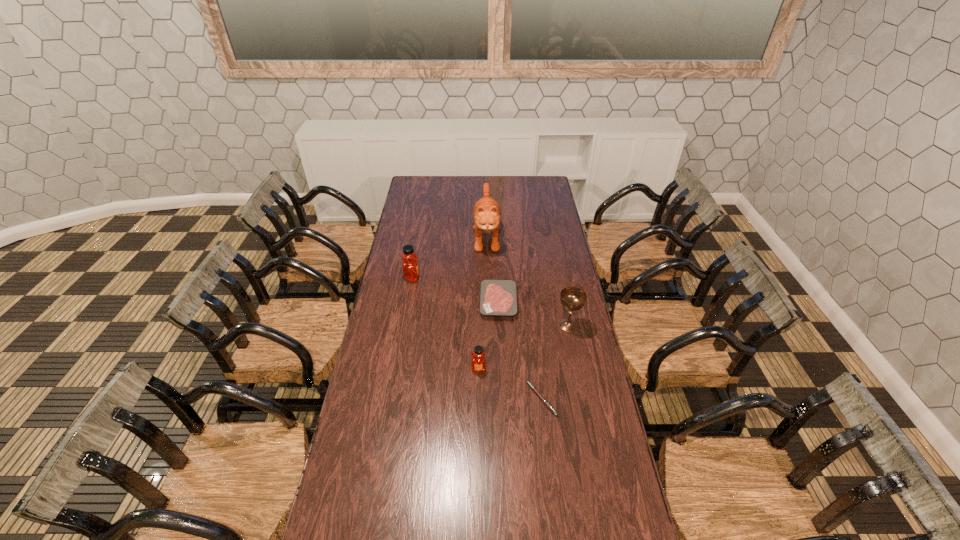
The honeys are evenly distributed in the image. To maintain this, where would you place another honey on the right? Please point to a free space. Please provide its 2D coordinates. Your answer should be formatted as a tuple, i.e. [(x, y)], where the tuple contains the x and y coordinates of a point satisfying the conditions above.

[(586, 518)]